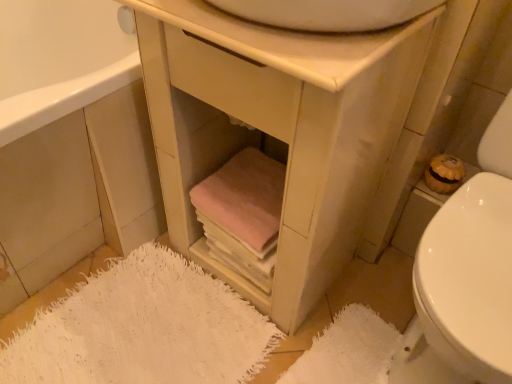
Question: Would you say white fuzzy bath mat at lower left, which is counted as the second bath mat, starting from the right, is to the left or to the right of white glossy toilet at lower right in the picture?

Choices:
 (A) right
 (B) left

Answer: (B)

Question: From the image's perspective, relative to white glossy toilet at lower right, is white fuzzy bath mat at lower left, arranged as the first bath mat when viewed from the left, above or below?

Choices:
 (A) below
 (B) above

Answer: (A)

Question: Estimate the real-world distances between objects in this image. Which object is farther from the matte white vanity at center?

Choices:
 (A) white fuzzy bath mat at lower left, which is counted as the second bath mat, starting from the right
 (B) matte wood cabinet at lower left
 (C) matte brown toilet paper at right
 (D) pink fabric towels at lower center
 (E) white glossy sink at upper center

Answer: (C)

Question: Based on their relative distances, which object is farther from the white glossy toilet at lower right?

Choices:
 (A) matte wood cabinet at lower left
 (B) matte brown toilet paper at right
 (C) white textured bath mat at lower right, the 1th bath mat positioned from the right
 (D) white glossy sink at upper center
 (E) pink fabric towels at lower center

Answer: (A)